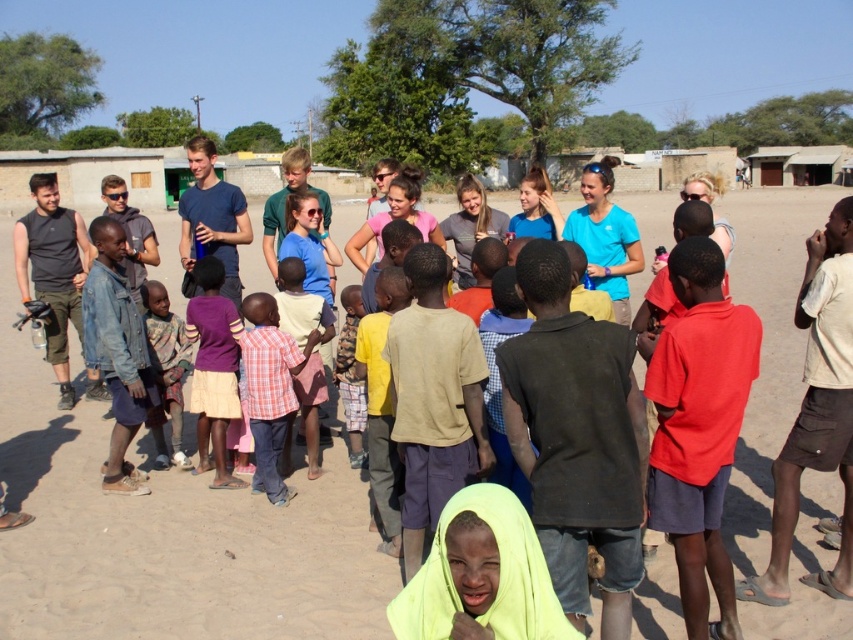
You are a photographer trying to capture a candid shot of the purple fabric skirt at center and the knitted sweater at center. Since you want to focus on both equally, which object should you zoom in on to ensure both are in frame without cropping?

The purple fabric skirt at center is smaller than the knitted sweater at center. To include both in the frame without cropping, you should zoom in on the larger object, the knitted sweater at center, as it will require less adjustment to fit both into the shot.

You are a photographer trying to capture a group photo of the purple fabric skirt at center and the knitted sweater at center. Since you want to ensure both are visible in the frame, which object should you focus on first to avoid blurriness?

The purple fabric skirt at center is much taller than the knitted sweater at center, so you should focus on the purple fabric skirt at center first to ensure proper focus on the taller object.